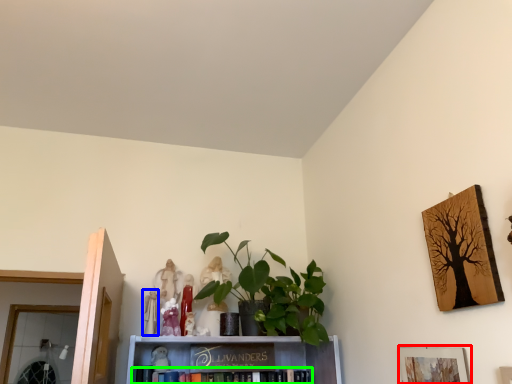
Question: Which is nearer to the picture frame (highlighted by a red box)? toy (highlighted by a blue box) or book (highlighted by a green box).

Choices:
 (A) toy
 (B) book

Answer: (B)